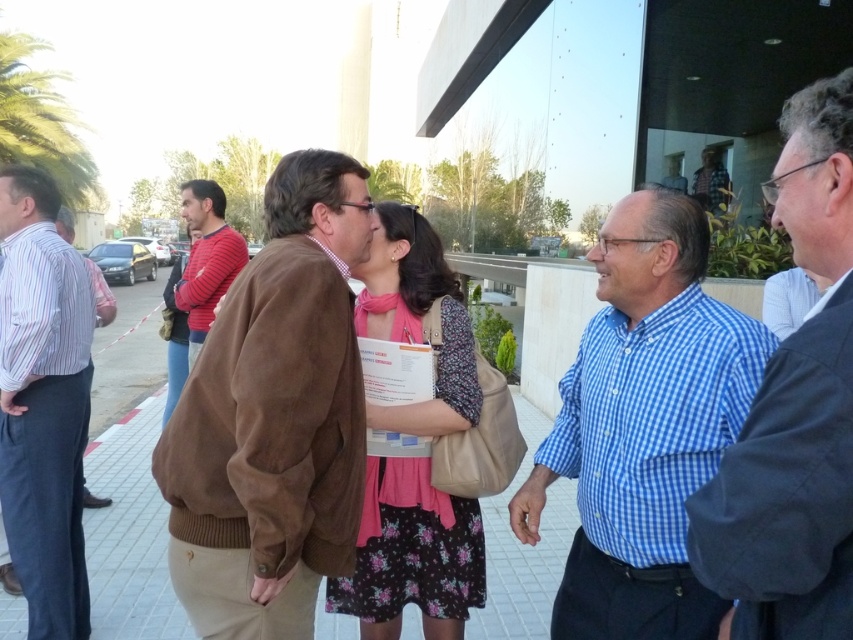
Does suede jacket at center have a lesser width compared to striped cotton shirt at left?

No.

Find the location of a particular element. suede jacket at center is located at coordinates pos(274,417).

What do you see at coordinates (274, 417) in the screenshot? I see `suede jacket at center` at bounding box center [274, 417].

The height and width of the screenshot is (640, 853). Identify the location of suede jacket at center. (274, 417).

Is dark blue checkered shirt at right wider than striped red and white shirt at left?

No.

Is dark blue checkered shirt at right to the left of striped red and white shirt at left from the viewer's perspective?

Incorrect, dark blue checkered shirt at right is not on the left side of striped red and white shirt at left.

Find the location of `dark blue checkered shirt at right`. dark blue checkered shirt at right is located at coordinates (793, 410).

Does striped red and white shirt at left have a greater width compared to striped shirt at left?

Yes.

Based on the photo, is striped red and white shirt at left behind striped shirt at left?

Yes, it is behind striped shirt at left.

Is point (192, 285) closer to camera compared to point (85, 502)?

Yes, it is.

Where is `striped red and white shirt at left`? striped red and white shirt at left is located at coordinates (206, 259).